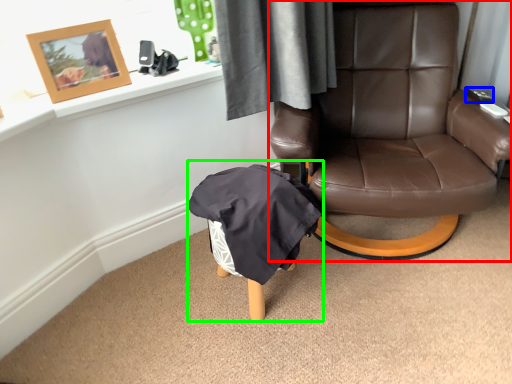
Question: Which is nearer to the chair (highlighted by a red box)? remote control (highlighted by a blue box) or bean bag chair (highlighted by a green box).

Choices:
 (A) remote control
 (B) bean bag chair

Answer: (B)